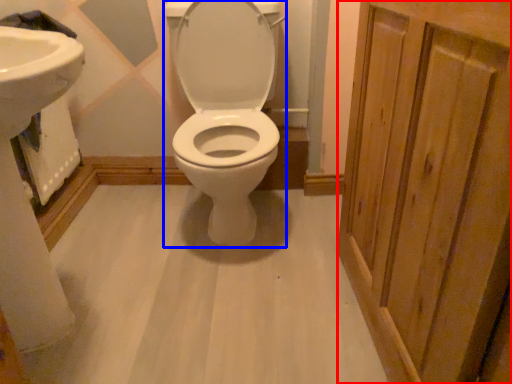
Question: Which object appears closest to the camera in this image, screen door (highlighted by a red box) or toilet (highlighted by a blue box)?

Choices:
 (A) screen door
 (B) toilet

Answer: (A)